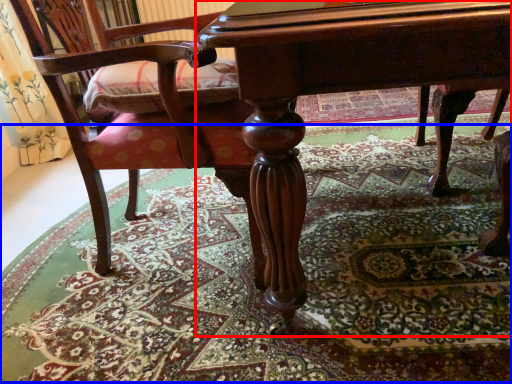
Question: Which of the following is the closest to the observer, table (highlighted by a red box) or mat (highlighted by a blue box)?

Choices:
 (A) table
 (B) mat

Answer: (A)